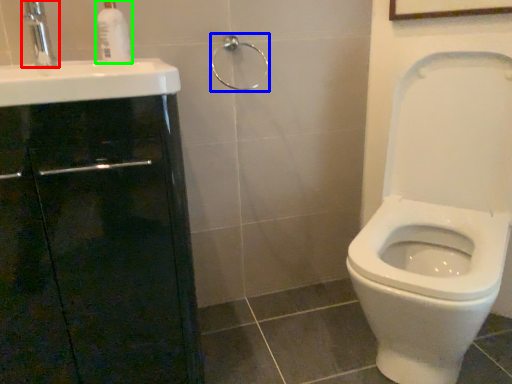
Question: Based on their relative distances, which object is nearer to tap (highlighted by a red box)? Choose from shower (highlighted by a blue box) and soap dispenser (highlighted by a green box).

Choices:
 (A) shower
 (B) soap dispenser

Answer: (B)